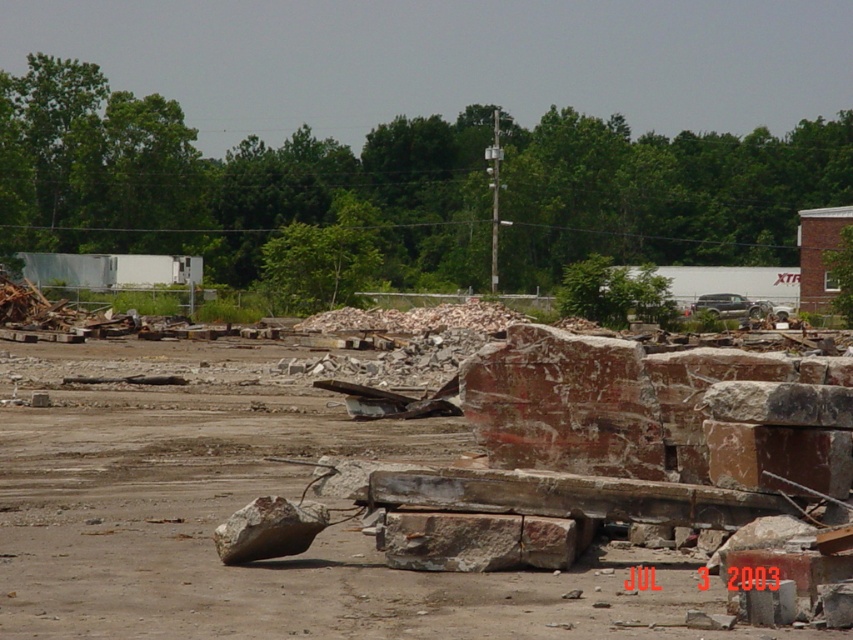
Question: Which point is closer to the camera taking this photo?

Choices:
 (A) (479, 544)
 (B) (320, 518)

Answer: (A)

Question: Is brown rough stone at center further to the viewer compared to rusty stone boulder at lower left?

Choices:
 (A) yes
 (B) no

Answer: (A)

Question: Can you confirm if brown rough stone at center is smaller than rusty stone boulder at lower left?

Choices:
 (A) yes
 (B) no

Answer: (A)

Question: Which object is closer to the camera taking this photo?

Choices:
 (A) rusty stone boulder at lower left
 (B) brown rough stone at center

Answer: (A)

Question: Which point is closer to the camera?

Choices:
 (A) (461, 513)
 (B) (289, 509)

Answer: (B)

Question: Is brown rough stone at center bigger than rusty stone boulder at lower left?

Choices:
 (A) no
 (B) yes

Answer: (A)